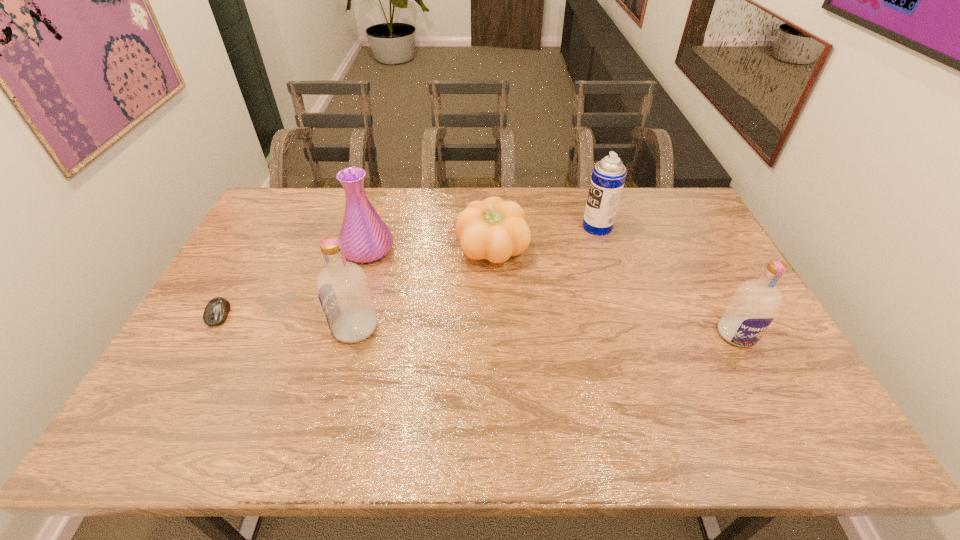
Image resolution: width=960 pixels, height=540 pixels. Identify the location of empty space between the taller vodka and the fifth object from left to right. (476, 278).

In order to click on empty space that is in between the left vodka and the leftmost object in this screenshot , I will do `click(287, 321)`.

At what (x,y) coordinates should I click in order to perform the action: click on vacant space in between the vase and the pumpkin. Please return your answer as a coordinate pair (x, y). This screenshot has height=540, width=960. Looking at the image, I should click on pos(430,250).

Locate an element on the screen. The image size is (960, 540). free spot between the taller vodka and the aerosol can is located at coordinates (476, 278).

This screenshot has height=540, width=960. Identify the location of the fourth closest object relative to the vase. (608, 176).

The height and width of the screenshot is (540, 960). I want to click on the fourth closest object to the aerosol can, so [x=343, y=291].